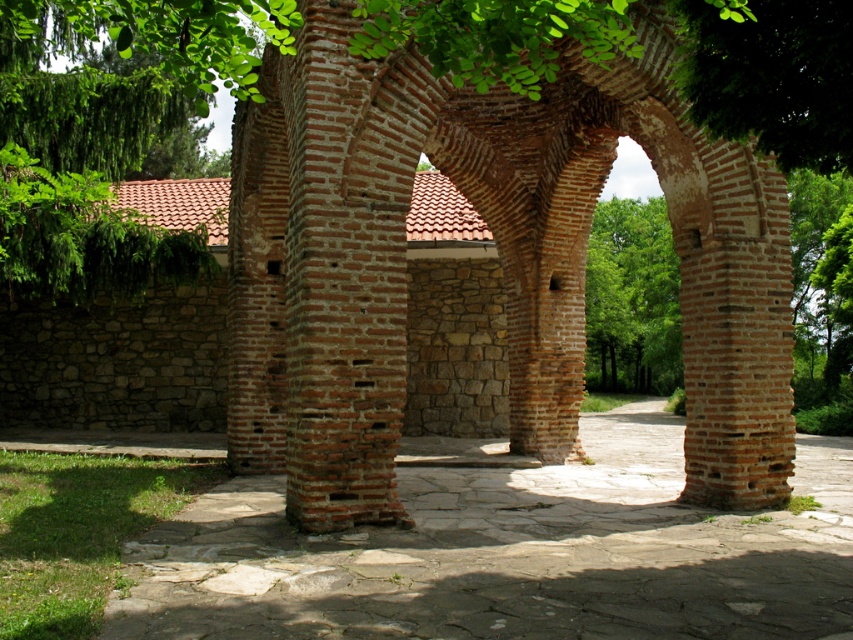
Question: Does brown brick arch at center appear under brown stone courtyard at center?

Choices:
 (A) no
 (B) yes

Answer: (A)

Question: Can you confirm if brown brick arch at center is positioned below brown stone courtyard at center?

Choices:
 (A) yes
 (B) no

Answer: (B)

Question: Which point is closer to the camera?

Choices:
 (A) brown stone courtyard at center
 (B) brown brick arch at center

Answer: (A)

Question: Can you confirm if brown brick arch at center is thinner than brown stone courtyard at center?

Choices:
 (A) yes
 (B) no

Answer: (A)

Question: Which point is closer to the camera taking this photo?

Choices:
 (A) (252, 516)
 (B) (712, 244)

Answer: (A)

Question: Which object is farther from the camera taking this photo?

Choices:
 (A) brown stone courtyard at center
 (B) brown brick arch at center

Answer: (B)